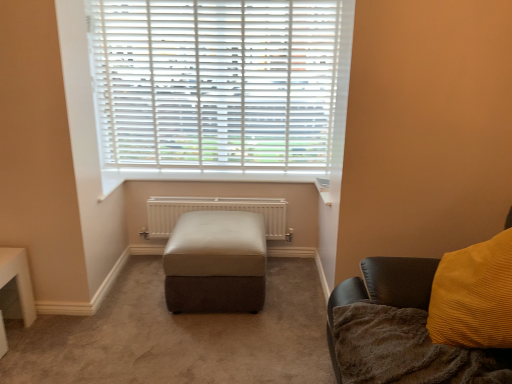
Question: Is leather ottoman at center bigger or smaller than white metallic radiator at center?

Choices:
 (A) big
 (B) small

Answer: (A)

Question: From a real-world perspective, is leather ottoman at center above or below white metallic radiator at center?

Choices:
 (A) above
 (B) below

Answer: (B)

Question: Estimate the real-world distances between objects in this image. Which object is closer to the leather ottoman at center?

Choices:
 (A) velvet mustard pillow at right
 (B) white plastic blinds at upper center
 (C) brown fuzzy blanket at lower right
 (D) white metallic radiator at center

Answer: (D)

Question: Which object is the farthest from the white metallic radiator at center?

Choices:
 (A) leather ottoman at center
 (B) velvet mustard pillow at right
 (C) brown fuzzy blanket at lower right
 (D) white plastic blinds at upper center

Answer: (C)